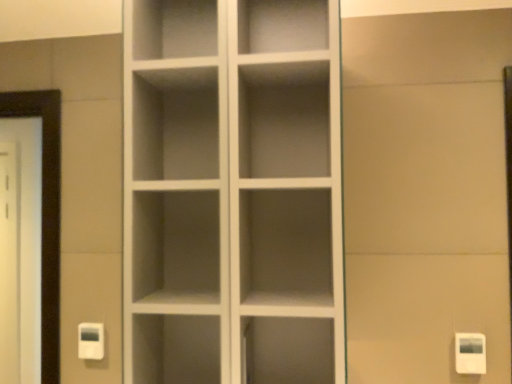
At what (x,y) coordinates should I click in order to perform the action: click on white plastic light switch at lower right. Please return your answer as a coordinate pair (x, y). Looking at the image, I should click on (470, 353).

What do you see at coordinates (470, 353) in the screenshot? The height and width of the screenshot is (384, 512). I see `white plastic light switch at lower right` at bounding box center [470, 353].

You are a GUI agent. You are given a task and a screenshot of the screen. Output one action in this format:
    pyautogui.click(x=<x>, y=<y>)
    Task: Click on the white plastic light switch at lower right
    
    Given the screenshot: What is the action you would take?
    pyautogui.click(x=470, y=353)